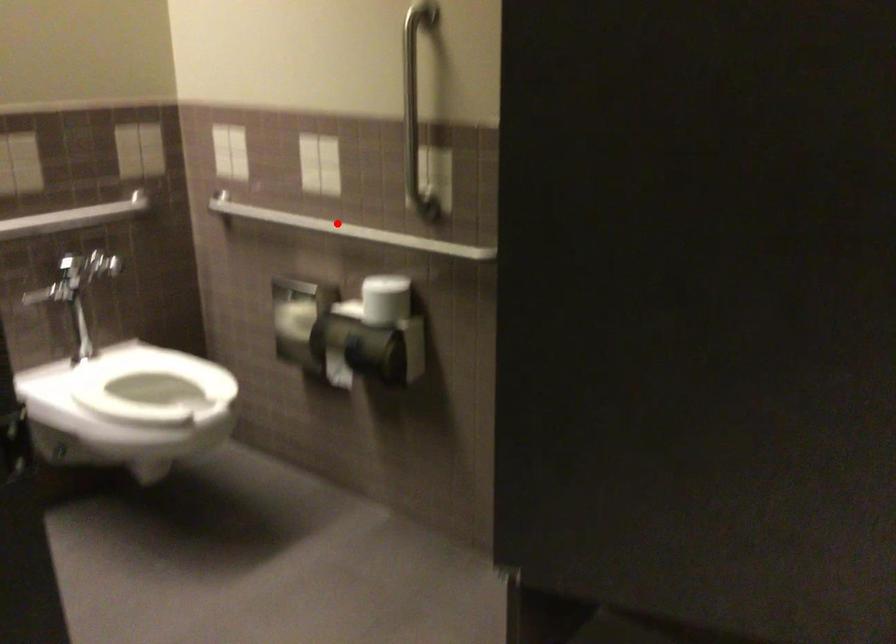
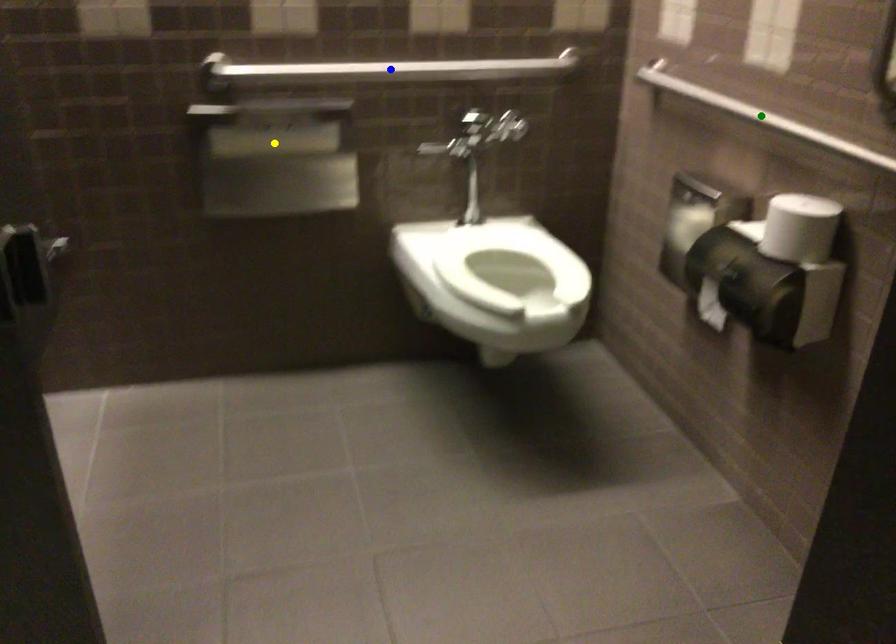
Question: I am providing you with two images of the same scene from different viewpoints. A red point is marked on the first image. You are given multiple points on the second image. Which spot in image 2 lines up with the point in image 1?

Choices:
 (A) green point
 (B) yellow point
 (C) blue point

Answer: (A)